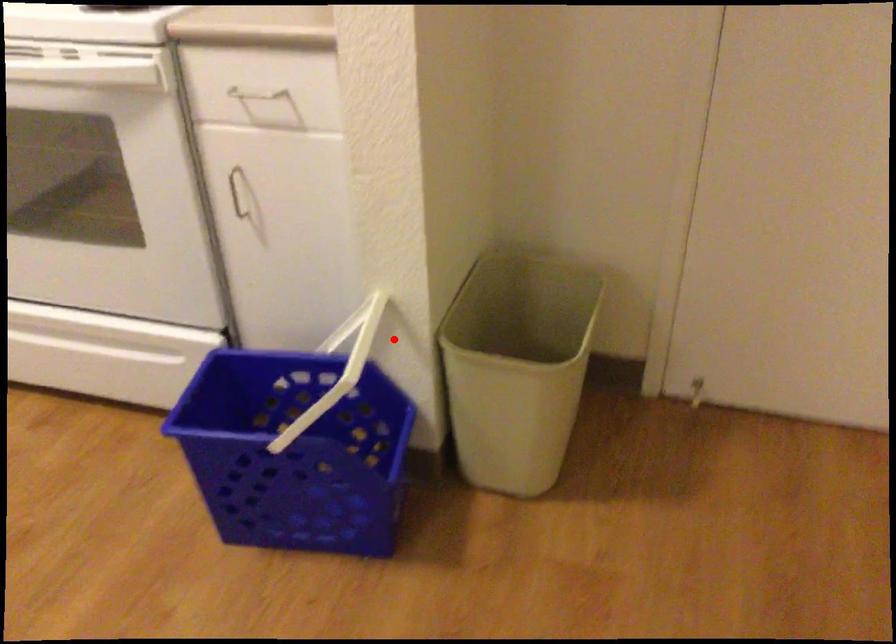
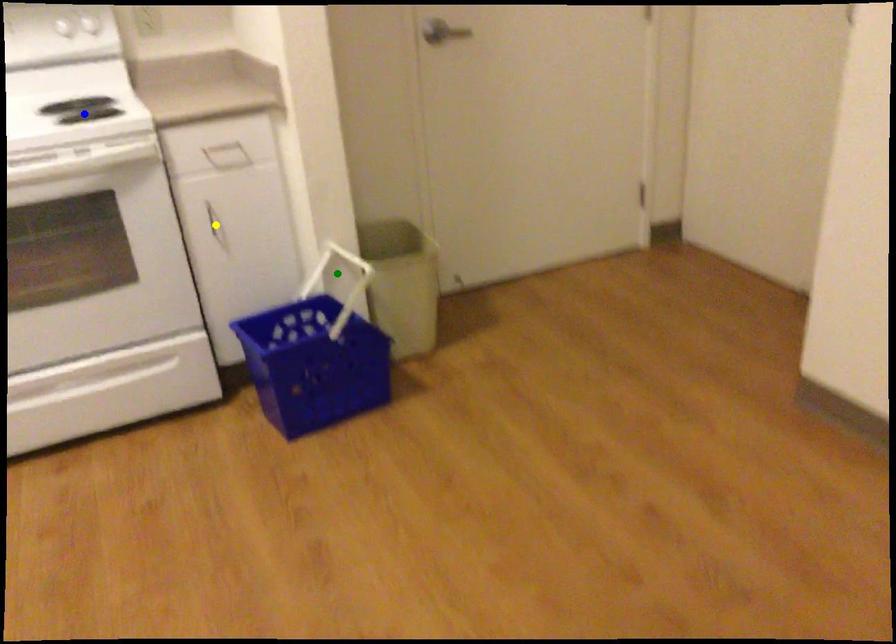
Question: I am providing you with two images of the same scene from different viewpoints. A red point is marked on the first image. You are given multiple points on the second image. In image 2, which mark is for the same physical point as the one in image 1?

Choices:
 (A) green point
 (B) blue point
 (C) yellow point

Answer: (A)